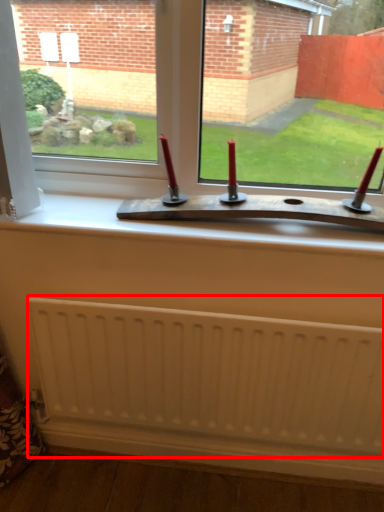
Question: From the image's perspective, where is radiator (annotated by the red box) located relative to window?

Choices:
 (A) above
 (B) below

Answer: (B)